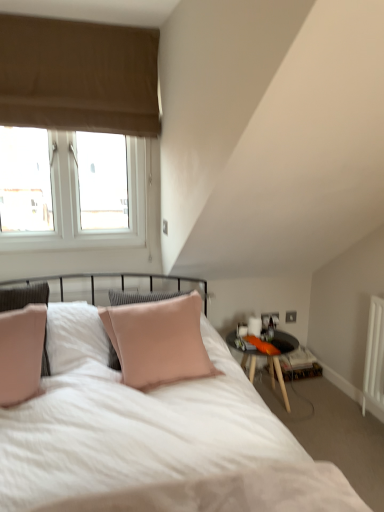
Question: From a real-world perspective, does beige fabric window at upper left sit lower than black glass table at right?

Choices:
 (A) yes
 (B) no

Answer: (B)

Question: Is black glass table at right a part of beige fabric window at upper left?

Choices:
 (A) no
 (B) yes

Answer: (A)

Question: Could you tell me if beige fabric window at upper left is turned towards black glass table at right?

Choices:
 (A) yes
 (B) no

Answer: (B)

Question: Would you say beige fabric window at upper left is outside black glass table at right?

Choices:
 (A) no
 (B) yes

Answer: (B)

Question: Is beige fabric window at upper left to the left of black glass table at right from the viewer's perspective?

Choices:
 (A) yes
 (B) no

Answer: (A)

Question: Is beige fabric window at upper left in front of black glass table at right?

Choices:
 (A) no
 (B) yes

Answer: (B)

Question: Does black glass table at right lie in front of beige fabric window at upper left?

Choices:
 (A) yes
 (B) no

Answer: (B)

Question: Is beige fabric window at upper left located within black glass table at right?

Choices:
 (A) no
 (B) yes

Answer: (A)

Question: Is black glass table at right completely or partially outside of beige fabric window at upper left?

Choices:
 (A) yes
 (B) no

Answer: (A)

Question: Considering the relative positions of black glass table at right and beige fabric window at upper left in the image provided, is black glass table at right to the left of beige fabric window at upper left from the viewer's perspective?

Choices:
 (A) yes
 (B) no

Answer: (B)

Question: From a real-world perspective, does black glass table at right sit lower than beige fabric window at upper left?

Choices:
 (A) yes
 (B) no

Answer: (A)

Question: From a real-world perspective, is black glass table at right on top of beige fabric window at upper left?

Choices:
 (A) no
 (B) yes

Answer: (A)

Question: From a real-world perspective, is beige fabric window at upper left physically located above or below black glass table at right?

Choices:
 (A) below
 (B) above

Answer: (B)